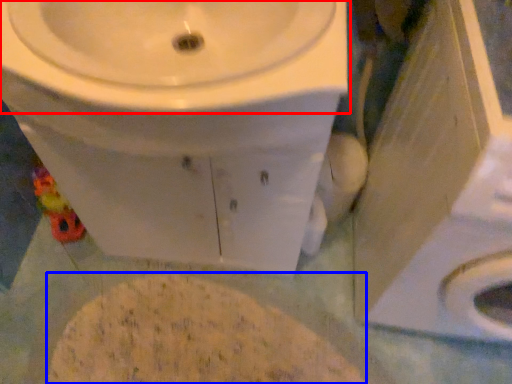
Question: Which object is further to the camera taking this photo, sink (highlighted by a red box) or flour (highlighted by a blue box)?

Choices:
 (A) sink
 (B) flour

Answer: (B)